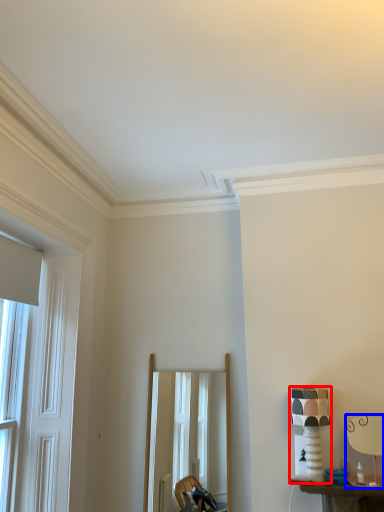
Question: Which object is further to the camera taking this photo, table lamp (highlighted by a red box) or table lamp (highlighted by a blue box)?

Choices:
 (A) table lamp
 (B) table lamp

Answer: (A)